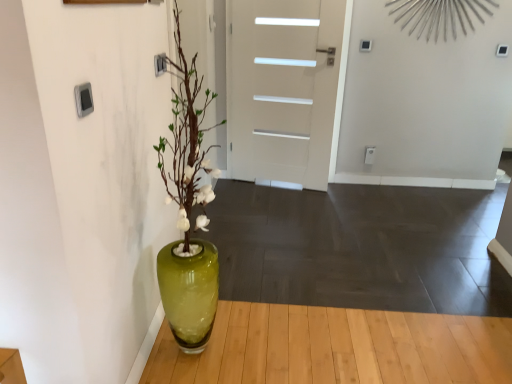
Where is `white matte door at center`? This screenshot has width=512, height=384. white matte door at center is located at coordinates (282, 89).

This screenshot has height=384, width=512. Describe the element at coordinates (282, 89) in the screenshot. I see `white matte door at center` at that location.

At what (x,y) coordinates should I click in order to perform the action: click on white matte door at center. Please return your answer as a coordinate pair (x, y). This screenshot has width=512, height=384. Looking at the image, I should click on (282, 89).